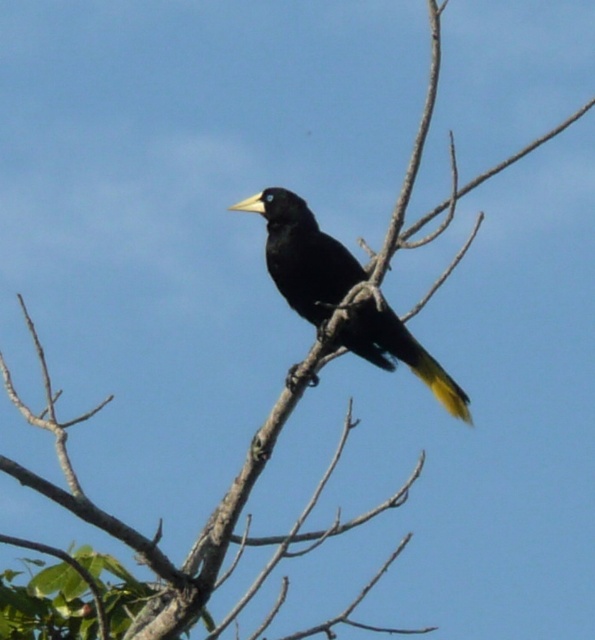
Who is more forward, (273,232) or (386,316)?

Point (386,316) is more forward.

Does black glossy bird at center appear on the right side of yellow matte tail at center?

No, black glossy bird at center is not to the right of yellow matte tail at center.

Is point (286, 211) positioned behind point (396, 337)?

Yes, it is.

I want to click on black glossy bird at center, so click(x=302, y=256).